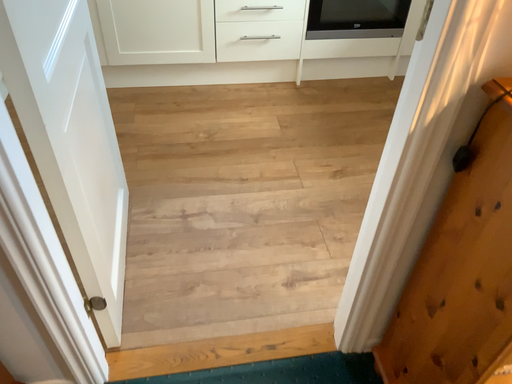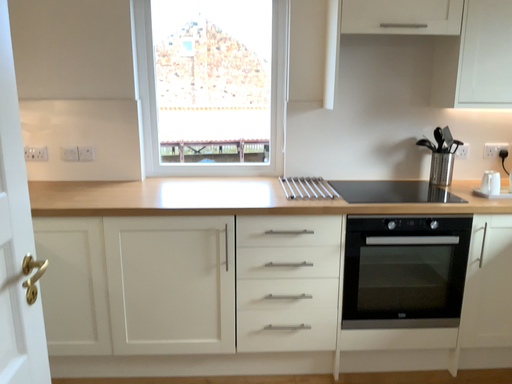
Question: How did the camera likely rotate when shooting the video?

Choices:
 (A) rotated upward
 (B) rotated downward

Answer: (A)